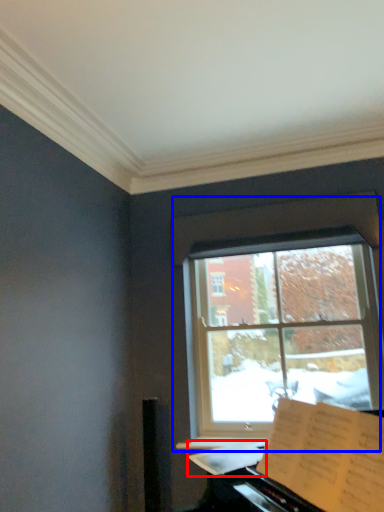
Question: Which object is further to the camera taking this photo, sheet music (highlighted by a red box) or window (highlighted by a blue box)?

Choices:
 (A) sheet music
 (B) window

Answer: (B)